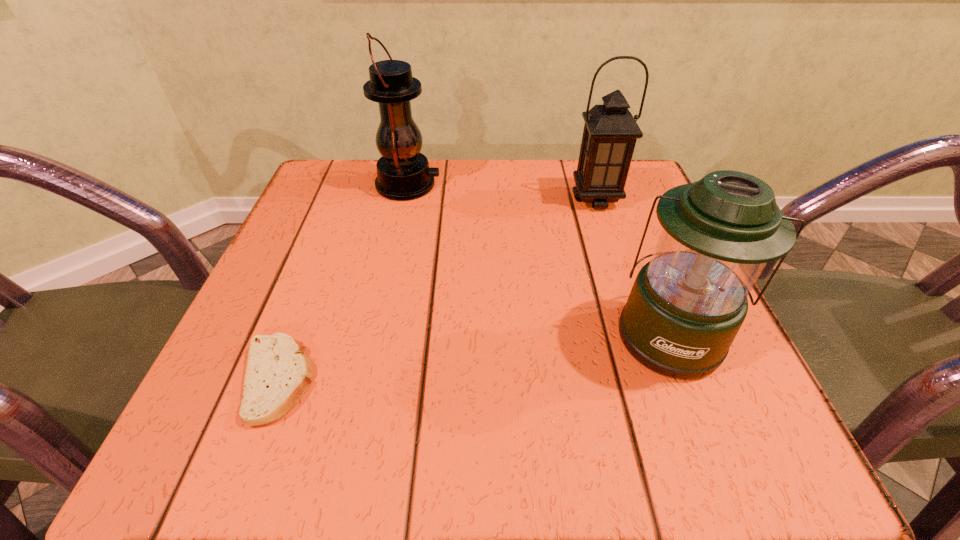
Where is `free space between the leftmost object and the nearest lantern`? This screenshot has width=960, height=540. free space between the leftmost object and the nearest lantern is located at coordinates (473, 357).

At what (x,y) coordinates should I click in order to perform the action: click on vacant area between the nearest lantern and the shortest object. Please return your answer as a coordinate pair (x, y). The width and height of the screenshot is (960, 540). Looking at the image, I should click on (473, 357).

Locate which object ranks third in proximity to the shortest object. Please provide its 2D coordinates. Your answer should be formatted as a tuple, i.e. [(x, y)], where the tuple contains the x and y coordinates of a point satisfying the conditions above.

[(610, 132)]

Locate which object is the closest to the shortest object. Please provide its 2D coordinates. Your answer should be formatted as a tuple, i.e. [(x, y)], where the tuple contains the x and y coordinates of a point satisfying the conditions above.

[(403, 173)]

Locate an element on the screen. This screenshot has height=540, width=960. lantern that can be found as the second closest to the nearest lantern is located at coordinates (403, 173).

At what (x,y) coordinates should I click in order to perform the action: click on lantern that stands as the second closest to the nearest lantern. Please return your answer as a coordinate pair (x, y). The image size is (960, 540). Looking at the image, I should click on (403, 173).

What are the coordinates of `vacant space that satisfies the following two spatial constraints: 1. above the leftmost lantern, indicating its light source; 2. on the back side of the nearest lantern` in the screenshot? It's located at (375, 334).

The image size is (960, 540). What are the coordinates of `vacant region that satisfies the following two spatial constraints: 1. above the leftmost lantern, indicating its light source; 2. on the right side of the nearest lantern` in the screenshot? It's located at (375, 334).

Find the location of a particular element. This screenshot has width=960, height=540. vacant point that satisfies the following two spatial constraints: 1. on the back side of the nearest lantern; 2. on the right side of the pita bread is located at coordinates (295, 334).